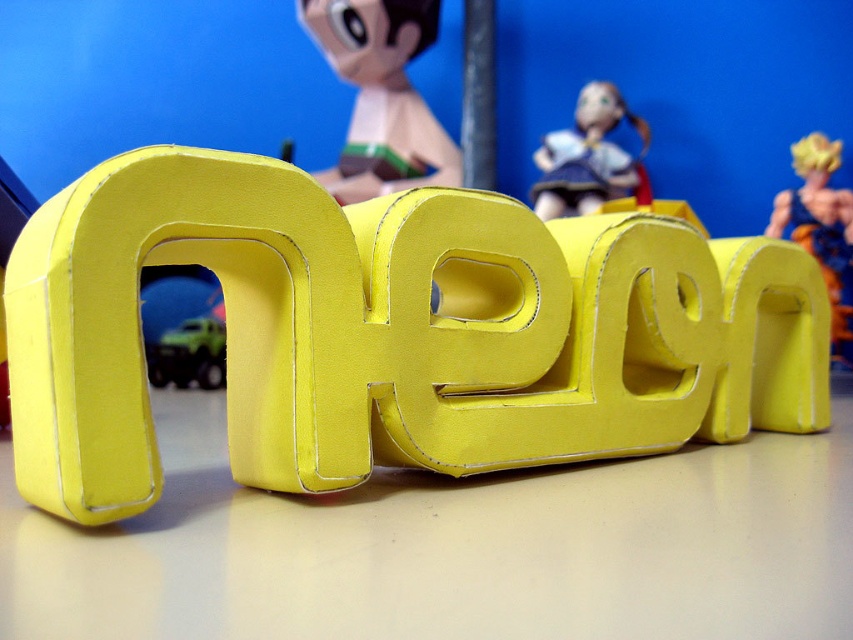
Question: Which point appears farthest from the camera in this image?

Choices:
 (A) (845, 340)
 (B) (514, 515)
 (C) (190, 342)

Answer: (C)

Question: Does matte plastic toy at upper center appear over matte green plastic toy truck at lower left?

Choices:
 (A) yes
 (B) no

Answer: (A)

Question: Considering the real-world distances, which object is farthest from the matte yellow table at center?

Choices:
 (A) matte green plastic toy truck at lower left
 (B) matte plastic toy at upper center

Answer: (A)

Question: Is matte yellow table at center closer to the viewer compared to matte green plastic toy truck at lower left?

Choices:
 (A) no
 (B) yes

Answer: (B)

Question: Can you confirm if matte yellow table at center is positioned to the right of matte plastic toy at upper center?

Choices:
 (A) yes
 (B) no

Answer: (A)

Question: Which object appears farthest from the camera in this image?

Choices:
 (A) matte green plastic toy truck at lower left
 (B) yellow cardboard letter at center
 (C) matte yellow doll at center

Answer: (C)